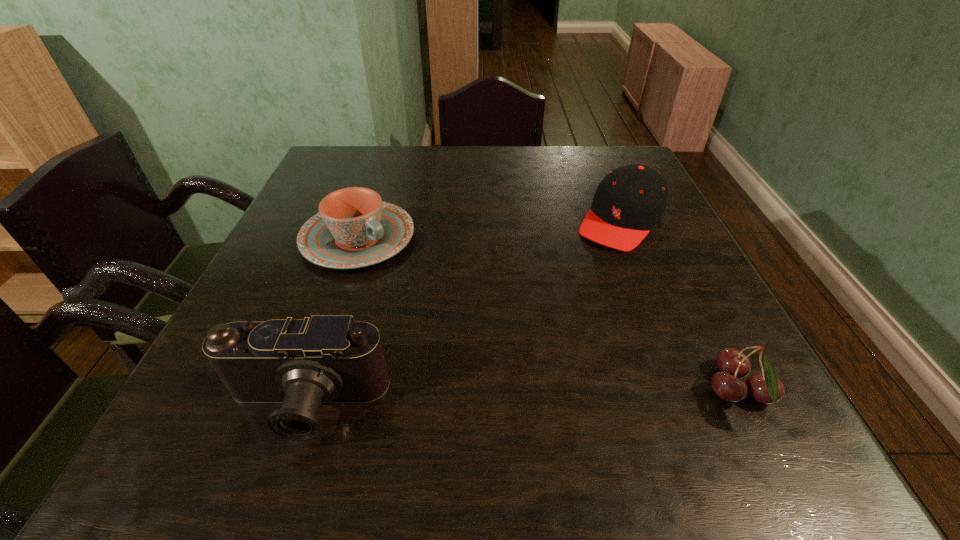
The width and height of the screenshot is (960, 540). Find the location of `free space between the chinaware and the cap`. free space between the chinaware and the cap is located at coordinates (490, 230).

This screenshot has width=960, height=540. Find the location of `object that stands as the closest to the chinaware`. object that stands as the closest to the chinaware is located at coordinates (301, 363).

Locate which object is the third closest to the cap. Please provide its 2D coordinates. Your answer should be formatted as a tuple, i.e. [(x, y)], where the tuple contains the x and y coordinates of a point satisfying the conditions above.

[(301, 363)]

Find the location of a particular element. The height and width of the screenshot is (540, 960). blank area in the image that satisfies the following two spatial constraints: 1. on the front side of the chinaware; 2. on the leaves of the cherry is located at coordinates (306, 392).

Locate an element on the screen. This screenshot has height=540, width=960. vacant space that satisfies the following two spatial constraints: 1. on the front side of the cap; 2. on the leaves of the cherry is located at coordinates (691, 392).

Locate an element on the screen. The width and height of the screenshot is (960, 540). vacant space that satisfies the following two spatial constraints: 1. on the front side of the cap; 2. on the leaves of the cherry is located at coordinates (691, 392).